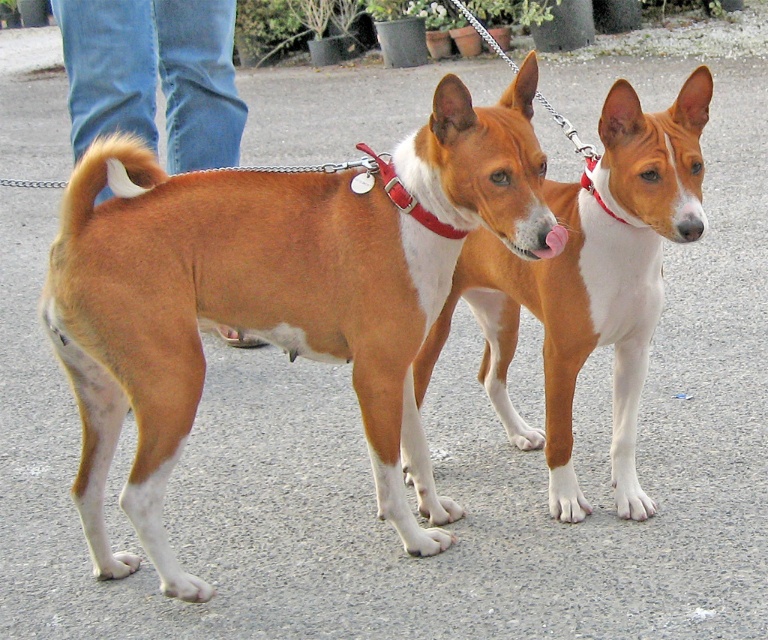
Which of these two, brown fur tail at lower left or red nylon collar at center, stands shorter?

Standing shorter between the two is red nylon collar at center.

Is brown fur tail at lower left closer to camera compared to red nylon collar at center?

That is False.

Who is more forward, [177,156] or [586,172]?

Point [586,172] is more forward.

The image size is (768, 640). Find the location of `brown fur tail at lower left`. brown fur tail at lower left is located at coordinates (154, 76).

Is brown fur tail at left to the left of red nylon collar at center from the viewer's perspective?

Yes, brown fur tail at left is to the left of red nylon collar at center.

In the scene shown: Is brown fur tail at left closer to the viewer compared to red nylon collar at center?

Yes, brown fur tail at left is closer to the viewer.

This screenshot has height=640, width=768. Find the location of `brown fur tail at left`. brown fur tail at left is located at coordinates (106, 177).

The width and height of the screenshot is (768, 640). Describe the element at coordinates (106, 177) in the screenshot. I see `brown fur tail at left` at that location.

Does brown fur tail at left have a larger size compared to red leather collar at center?

No, brown fur tail at left is not bigger than red leather collar at center.

Is point (84, 156) positioned after point (402, 186)?

No, (84, 156) is in front of (402, 186).

Identify the location of brown fur tail at left. (106, 177).